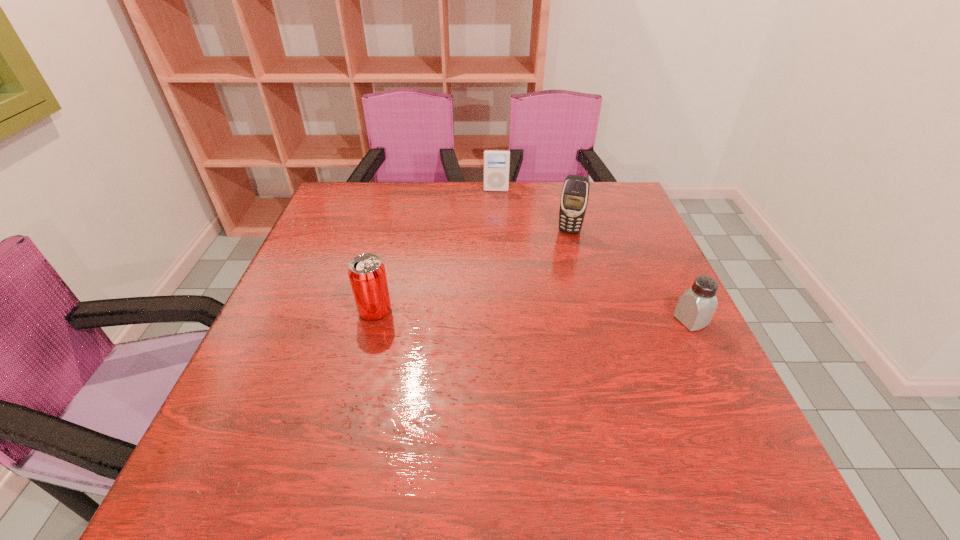
At what (x,y) coordinates should I click in order to perform the action: click on vacant space on the desktop that is between the soda can and the shortest object and is positioned on the front face of the cellular telephone. Please return your answer as a coordinate pair (x, y). This screenshot has width=960, height=540. Looking at the image, I should click on (547, 316).

I want to click on free space on the desktop that is between the soda can and the saltshaker and is positioned on the front-facing side of the second object from left to right, so click(x=493, y=315).